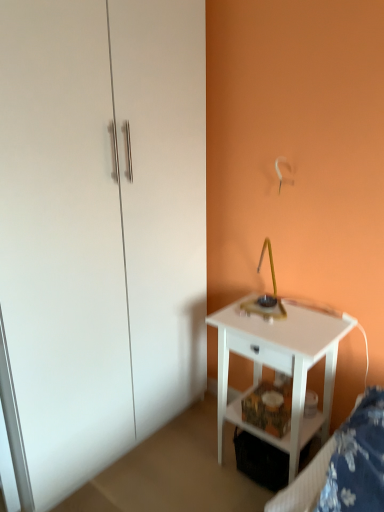
The image size is (384, 512). I want to click on free region on the left part of white glossy nightstand at lower right, so click(184, 465).